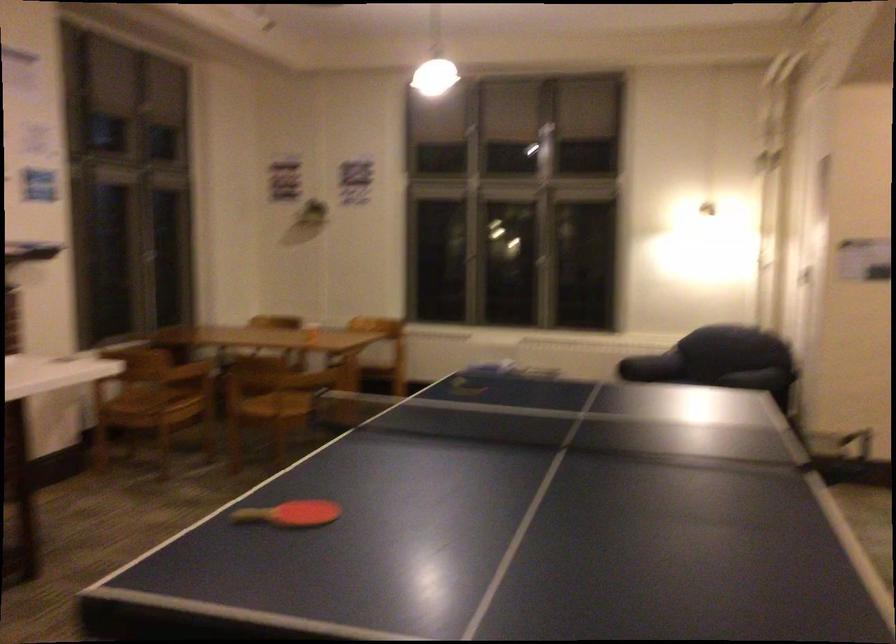
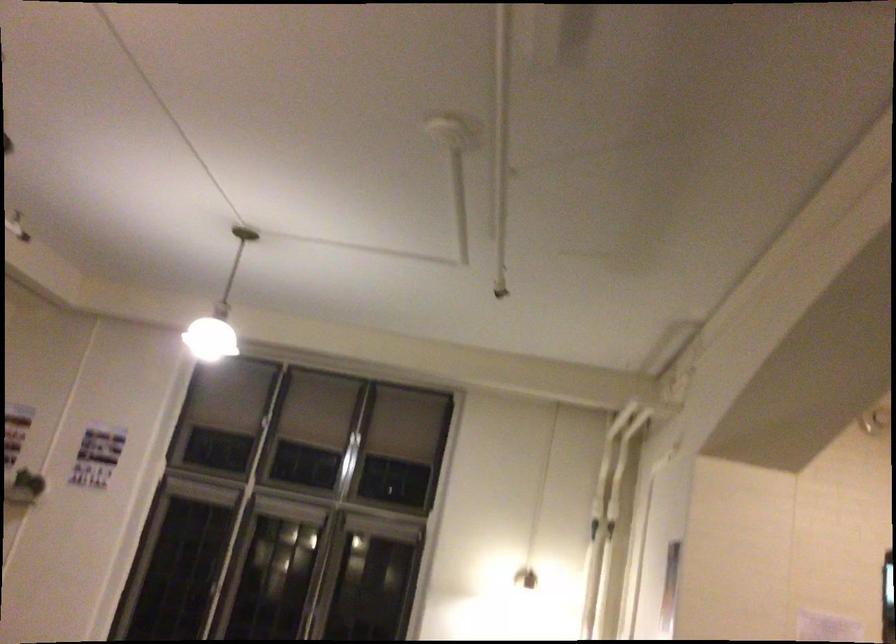
Where in the second image is the point corresponding to (x=728, y=114) from the first image?

(588, 529)